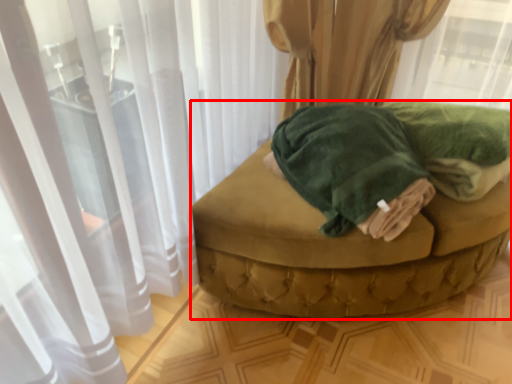
Question: Where is furniture (annotated by the red box) located in relation to bath towel in the image?

Choices:
 (A) right
 (B) left

Answer: (A)